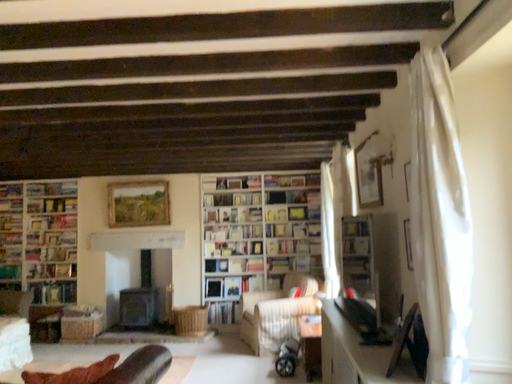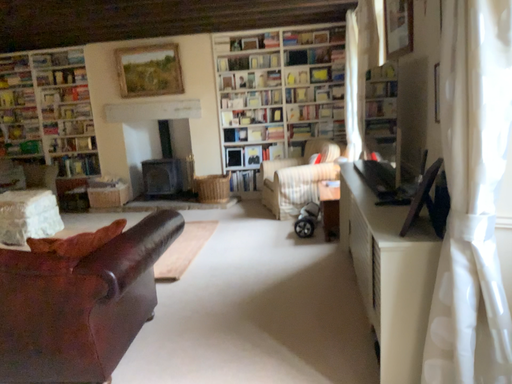
Question: Which way did the camera rotate in the video?

Choices:
 (A) rotated downward
 (B) rotated upward

Answer: (A)